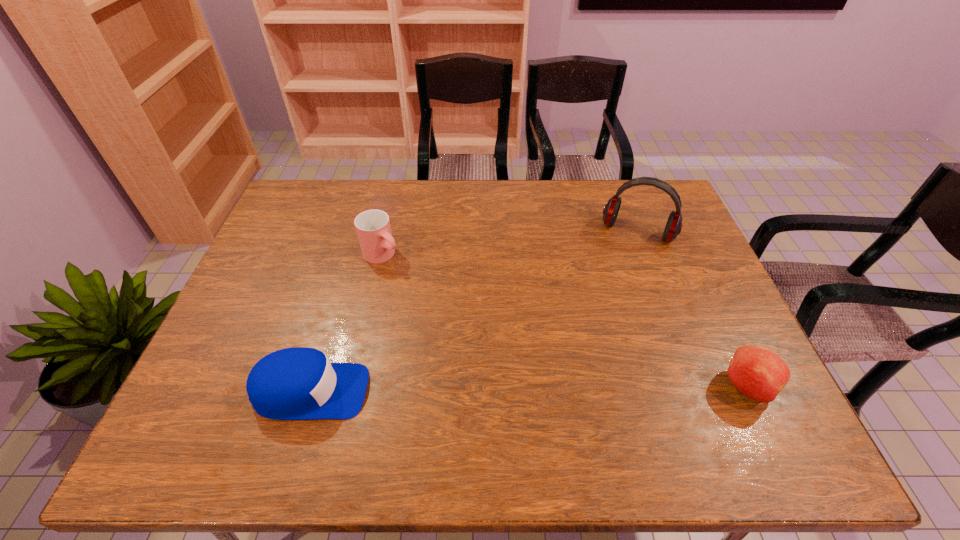
Where is `vacant space on the desktop that is between the baseball cap and the apple and is positioned on the side of the cup with the handle`? The height and width of the screenshot is (540, 960). vacant space on the desktop that is between the baseball cap and the apple and is positioned on the side of the cup with the handle is located at coordinates (559, 389).

At what (x,y) coordinates should I click in order to perform the action: click on free space on the desktop that is between the baseball cap and the apple and is positioned on the ear cups of the tallest object. Please return your answer as a coordinate pair (x, y). Looking at the image, I should click on (583, 388).